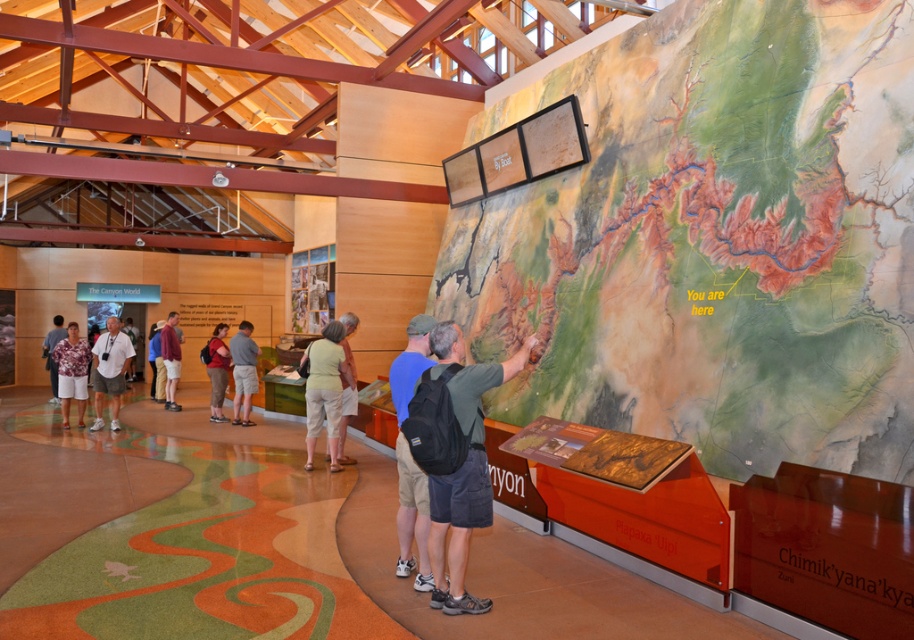
You are standing in front of the exhibit map and notice two points marked on it. The first point is at coordinate point (332, 349) and the second is at coordinate point (151, 365). Which point is closer to your viewpoint?

Point (332, 349) is closer to the camera than point (151, 365), so the first point is closer to your viewpoint.

You are standing in the exhibit and notice the textured paper map at center and the light green fabric pants at center. Which object is wider?

The light green fabric pants at center are wider than the textured paper map at center.